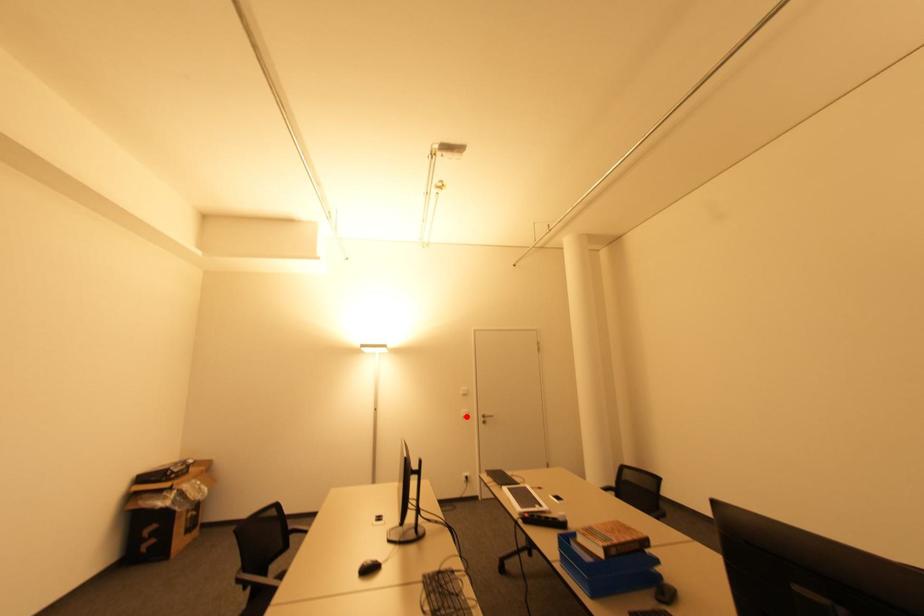
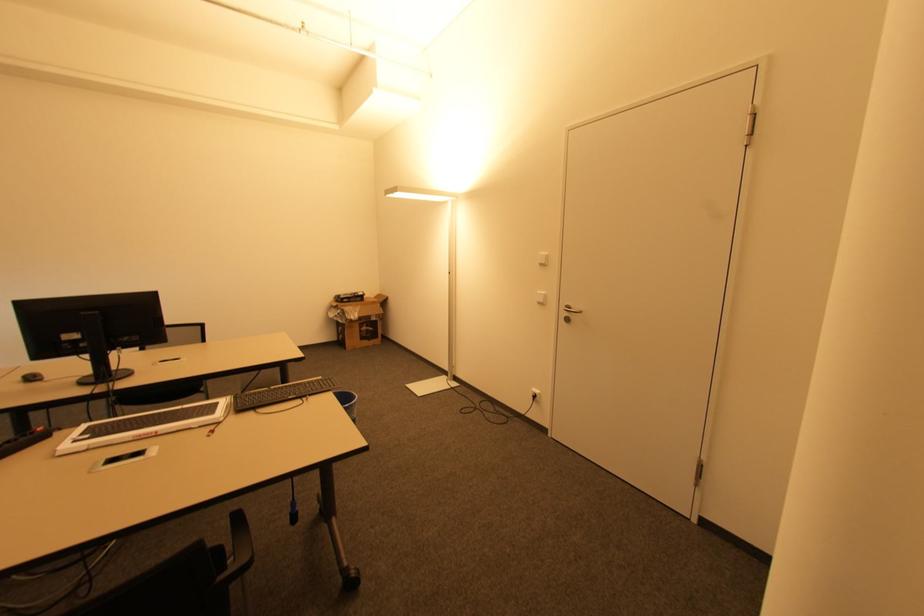
Locate, in the second image, the point that corresponds to the highlighted location in the first image.

(541, 302)